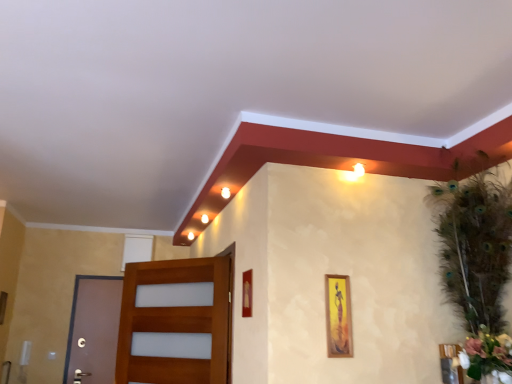
Question: Is point (205, 317) positioned closer to the camera than point (349, 289)?

Choices:
 (A) farther
 (B) closer

Answer: (A)

Question: From a real-world perspective, is wooden door at left, which appears as the 1th door when viewed from the right, positioned above or below wooden picture frame at center-right, the second picture frame viewed from the right?

Choices:
 (A) below
 (B) above

Answer: (A)

Question: Based on their relative distances, which object is farther from the wooden picture frame at lower right, the 1th picture frame viewed from the right?

Choices:
 (A) white matte flower at right
 (B) matte gold picture frame at center, which appears as the 1th picture frame when viewed from the left
 (C) wooden door at left, which appears as the 1th door when viewed from the right
 (D) wooden picture frame at center-right, the 2th picture frame positioned from the left
 (E) brown matte door at left, which is the second door from right to left

Answer: (E)

Question: Estimate the real-world distances between objects in this image. Which object is closer to the wooden picture frame at lower right, the 1th picture frame viewed from the right?

Choices:
 (A) matte gold picture frame at center, which is the third picture frame from right to left
 (B) brown matte door at left, which is the second door from right to left
 (C) white matte flower at right
 (D) wooden door at left, positioned as the 1th door in front-to-back order
 (E) wooden picture frame at center-right, the second picture frame viewed from the right

Answer: (C)